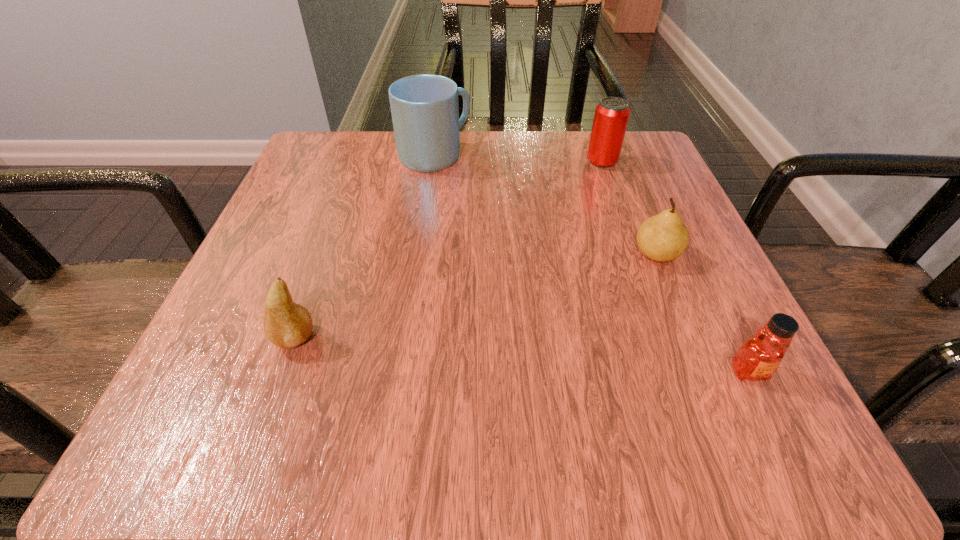
Identify the location of vacant region located 0.380m on the right of the left pear. (595, 339).

You are a GUI agent. You are given a task and a screenshot of the screen. Output one action in this format:
    pyautogui.click(x=<x>, y=<y>)
    Task: Click on the blank space located on the front label of the nearest object
    This screenshot has width=960, height=540.
    Given the screenshot: What is the action you would take?
    pyautogui.click(x=783, y=442)

Find the location of `mug that is at the far edge`. mug that is at the far edge is located at coordinates (425, 111).

You are a GUI agent. You are given a task and a screenshot of the screen. Output one action in this format:
    pyautogui.click(x=<x>, y=<y>)
    Task: Click on the can that is at the far edge
    
    Given the screenshot: What is the action you would take?
    pyautogui.click(x=611, y=117)

The height and width of the screenshot is (540, 960). Identify the location of object that is at the left edge. (286, 324).

Where is `can at the right edge`? can at the right edge is located at coordinates (611, 117).

What are the coordinates of `pear present at the right edge` in the screenshot? It's located at (664, 237).

Identify the location of honey that is at the right edge. This screenshot has width=960, height=540. (759, 356).

Where is `object that is at the far right corner`? The height and width of the screenshot is (540, 960). object that is at the far right corner is located at coordinates (611, 117).

You are a GUI agent. You are given a task and a screenshot of the screen. Output one action in this format:
    pyautogui.click(x=<x>, y=<y>)
    Task: Click on the vacant area at the far edge
    This screenshot has width=960, height=540.
    Given the screenshot: What is the action you would take?
    pyautogui.click(x=561, y=141)